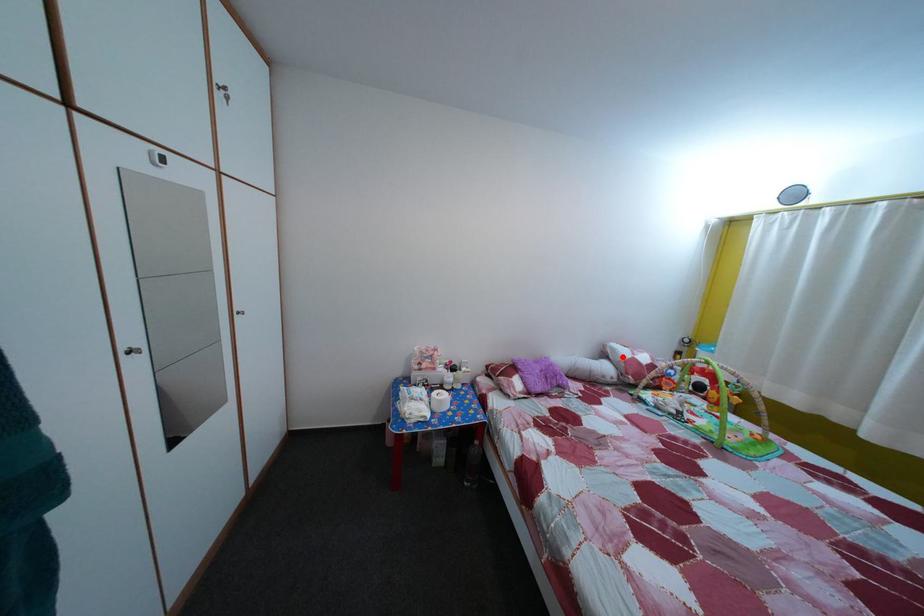
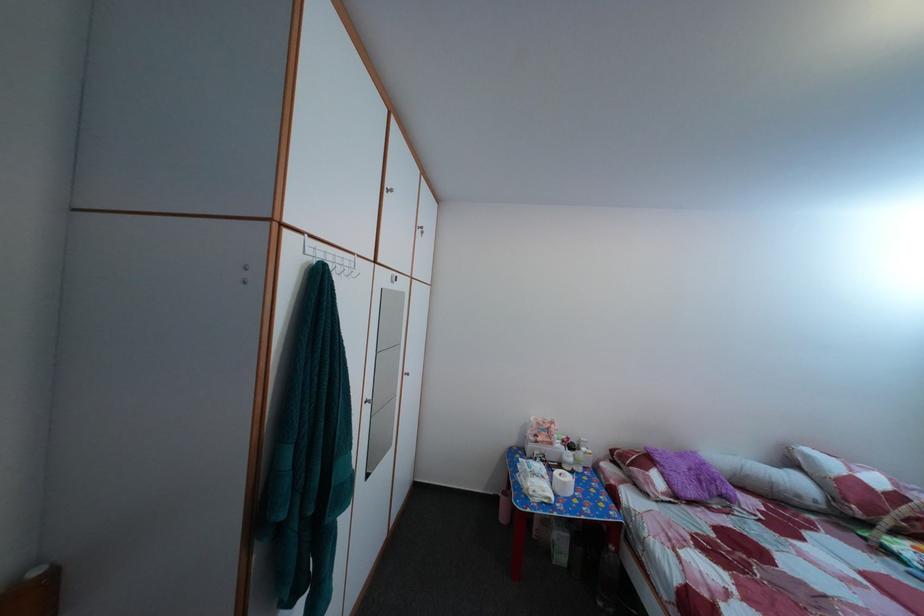
In the second image, find the point that corresponds to the highlighted location in the first image.

(817, 464)